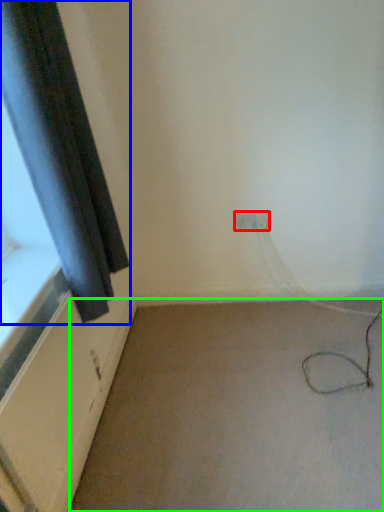
Question: Which is farther away from electric outlet (highlighted by a red box)? curtain (highlighted by a blue box) or plain (highlighted by a green box)?

Choices:
 (A) curtain
 (B) plain

Answer: (A)